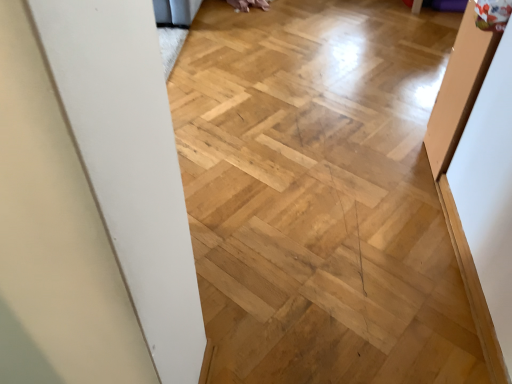
What do you see at coordinates (458, 90) in the screenshot?
I see `light brown wood door at upper right` at bounding box center [458, 90].

Where is `light brown wood door at upper right`? The height and width of the screenshot is (384, 512). light brown wood door at upper right is located at coordinates (458, 90).

Identify the location of light brown wood door at upper right. (458, 90).